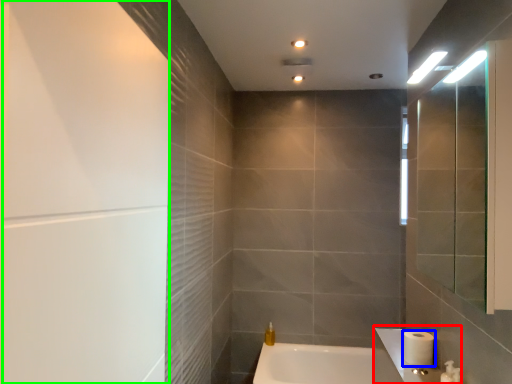
Question: Considering the real-world distances, which object is farthest from sink (highlighted by a red box)? toilet paper (highlighted by a blue box) or screen door (highlighted by a green box)?

Choices:
 (A) toilet paper
 (B) screen door

Answer: (B)